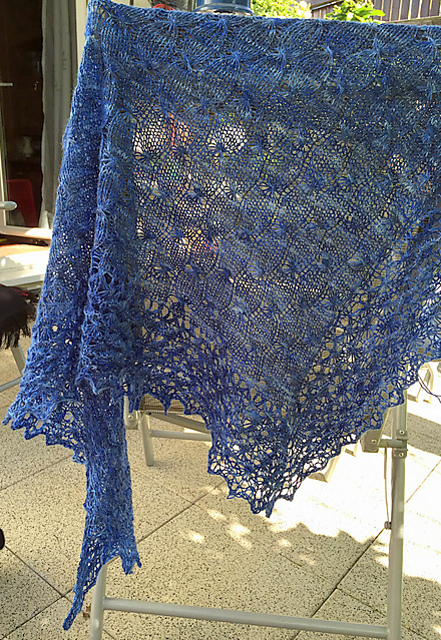
Where is `tile`? This screenshot has width=441, height=640. tile is located at coordinates (62, 630).